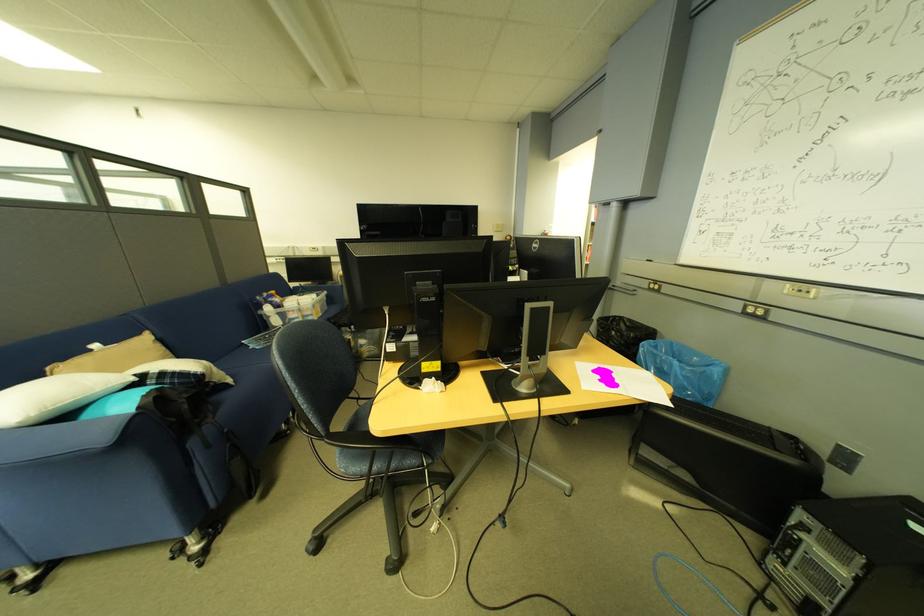
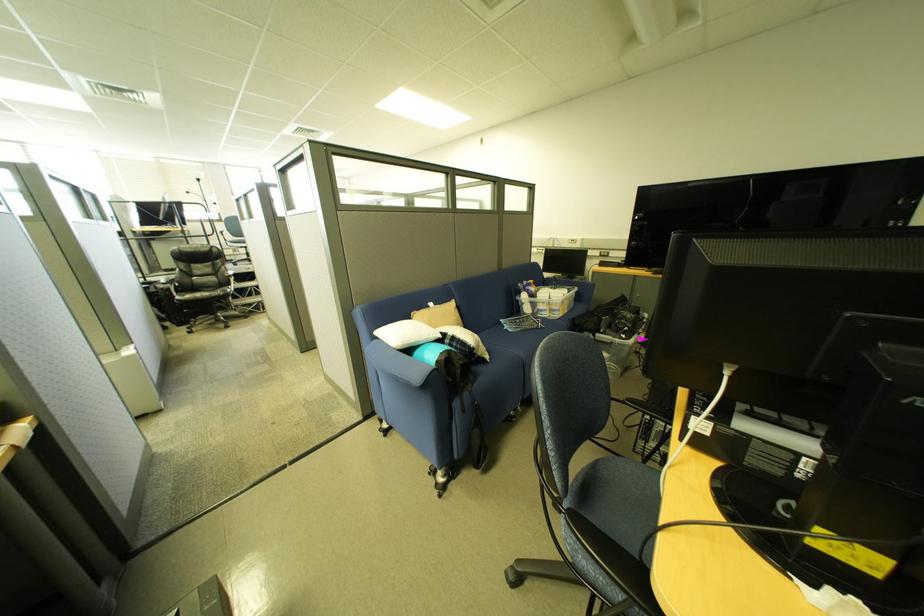
Where in the second image is the point corresponding to point 275,321 from the first image?

(530, 306)